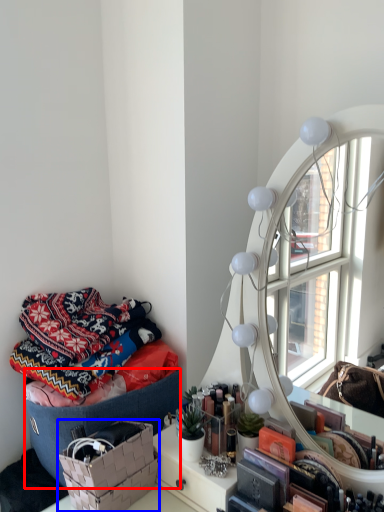
Question: Which point is closer to the camera, storage box (highlighted by a red box) or basket (highlighted by a blue box)?

Choices:
 (A) storage box
 (B) basket

Answer: (B)